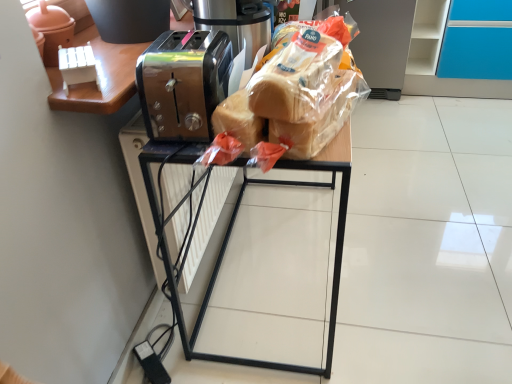
Question: From a real-world perspective, is translucent plastic bread at center on top of translucent plastic bread at center, arranged as the second bread when ordered from the bottom?

Choices:
 (A) no
 (B) yes

Answer: (A)

Question: Is translucent plastic bread at center looking in the opposite direction of translucent plastic bread at center, arranged as the second bread when ordered from the bottom?

Choices:
 (A) yes
 (B) no

Answer: (B)

Question: Can you confirm if translucent plastic bread at center is positioned to the right of translucent plastic bread at center, the first bread positioned from the top?

Choices:
 (A) no
 (B) yes

Answer: (B)

Question: Does translucent plastic bread at center have a larger size compared to translucent plastic bread at center, arranged as the second bread when ordered from the bottom?

Choices:
 (A) no
 (B) yes

Answer: (B)

Question: Could you tell me if translucent plastic bread at center is turned towards translucent plastic bread at center, the first bread positioned from the top?

Choices:
 (A) yes
 (B) no

Answer: (A)

Question: In the image, is translucent plastic bread at center, which is the second bread in top-to-bottom order, positioned in front of or behind metallic toaster at center?

Choices:
 (A) behind
 (B) front

Answer: (B)

Question: Choose the correct answer: Is translucent plastic bread at center, the 1th bread from the bottom, inside metallic toaster at center or outside it?

Choices:
 (A) inside
 (B) outside

Answer: (B)

Question: From the image's perspective, is translucent plastic bread at center, the 1th bread from the bottom, above or below metallic toaster at center?

Choices:
 (A) below
 (B) above

Answer: (B)

Question: Would you say translucent plastic bread at center, the 1th bread from the bottom, is to the left or to the right of metallic toaster at center in the picture?

Choices:
 (A) left
 (B) right

Answer: (B)

Question: In the image, is translucent plastic bread at center, the 1th bread from the bottom, positioned in front of or behind translucent plastic bread at center, the first bread positioned from the top?

Choices:
 (A) behind
 (B) front

Answer: (A)

Question: Is point (330, 109) positioned closer to the camera than point (330, 43)?

Choices:
 (A) closer
 (B) farther

Answer: (A)

Question: Choose the correct answer: Is translucent plastic bread at center, the 1th bread from the bottom, inside translucent plastic bread at center, the first bread positioned from the top, or outside it?

Choices:
 (A) outside
 (B) inside

Answer: (A)

Question: In terms of size, does translucent plastic bread at center, the 1th bread from the bottom, appear bigger or smaller than translucent plastic bread at center, arranged as the second bread when ordered from the bottom?

Choices:
 (A) small
 (B) big

Answer: (A)

Question: Relative to metallic toaster at center, is translucent plastic bread at center in front or behind?

Choices:
 (A) behind
 (B) front

Answer: (A)

Question: Considering the positions of point (379, 44) and point (180, 321), is point (379, 44) closer or farther from the camera than point (180, 321)?

Choices:
 (A) closer
 (B) farther

Answer: (B)